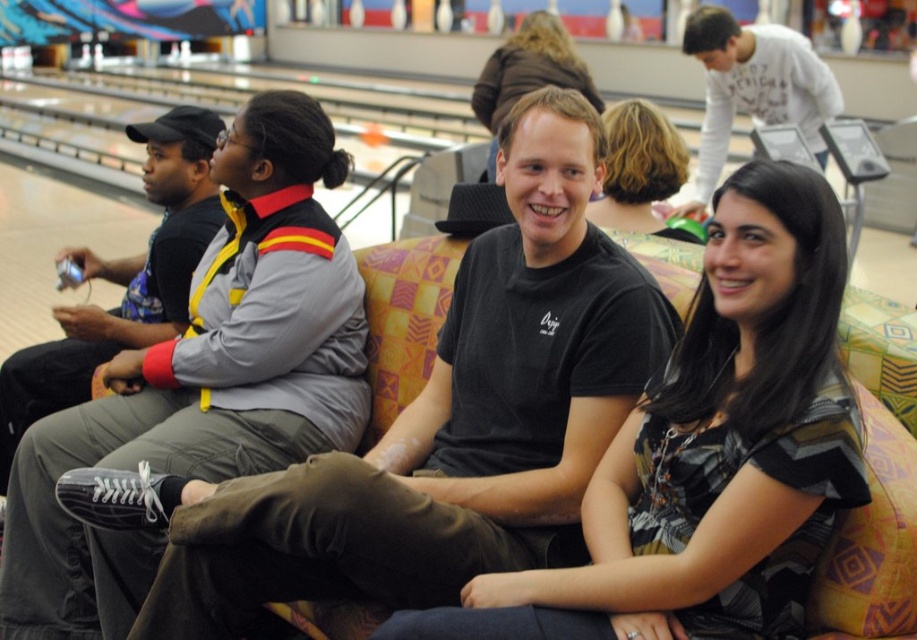
Question: Estimate the real-world distances between objects in this image. Which object is closer to the black leather shoes at lower left?

Choices:
 (A) black matte sneakers at left
 (B) black matte shirt at center
 (C) printed fabric dress at center

Answer: (A)

Question: Does black leather shoes at lower left appear on the left side of dark brown hair at center?

Choices:
 (A) yes
 (B) no

Answer: (A)

Question: Does printed fabric dress at center appear under black matte sneakers at left?

Choices:
 (A) yes
 (B) no

Answer: (A)

Question: From the image, what is the correct spatial relationship of printed fabric dress at center in relation to black leather shoes at lower left?

Choices:
 (A) below
 (B) above

Answer: (A)

Question: Which of these objects is positioned closest to the black matte shirt at center?

Choices:
 (A) black matte sneakers at left
 (B) white cotton shirt at upper right
 (C) printed fabric dress at center
 (D) matte black shirt at center

Answer: (C)

Question: Which object appears closest to the camera in this image?

Choices:
 (A) white cotton shirt at upper right
 (B) black leather shoes at lower left
 (C) printed fabric dress at center

Answer: (C)